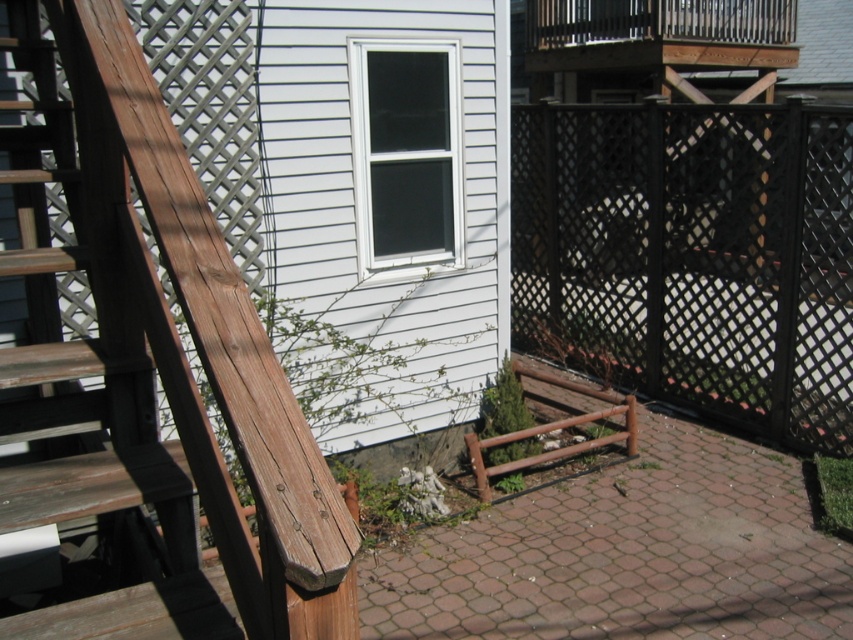
Question: Which object is the farthest from the black lattice fence at lower right?

Choices:
 (A) weathered wood ladder at left
 (B) wooden deck at center

Answer: (A)

Question: Is weathered wood ladder at left wider than wooden deck at center?

Choices:
 (A) yes
 (B) no

Answer: (B)

Question: Does weathered wood ladder at left appear under wooden deck at center?

Choices:
 (A) no
 (B) yes

Answer: (A)

Question: Which object appears farthest from the camera in this image?

Choices:
 (A) weathered wood ladder at left
 (B) wooden deck at center
 (C) black lattice fence at lower right

Answer: (C)

Question: Observing the image, what is the correct spatial positioning of black lattice fence at lower right in reference to wooden deck at center?

Choices:
 (A) below
 (B) above

Answer: (B)

Question: Which of the following is the closest to the observer?

Choices:
 (A) (428, 627)
 (B) (759, 292)
 (C) (27, 508)

Answer: (C)